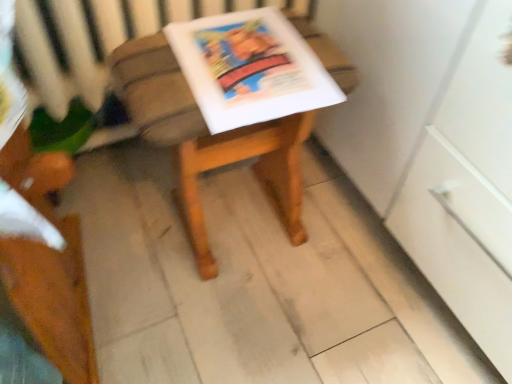
The image size is (512, 384). Describe the element at coordinates (207, 140) in the screenshot. I see `wooden table at center` at that location.

You are a GUI agent. You are given a task and a screenshot of the screen. Output one action in this format:
    pyautogui.click(x=<x>, y=<y>)
    Task: Click on the wooden table at center
    This screenshot has height=384, width=512.
    Given the screenshot: What is the action you would take?
    pyautogui.click(x=207, y=140)

At what (x,y) coordinates should I click in order to perform the action: click on wooden table at center. Please return your answer as a coordinate pair (x, y). Image resolution: width=512 pixels, height=384 pixels. Looking at the image, I should click on (207, 140).